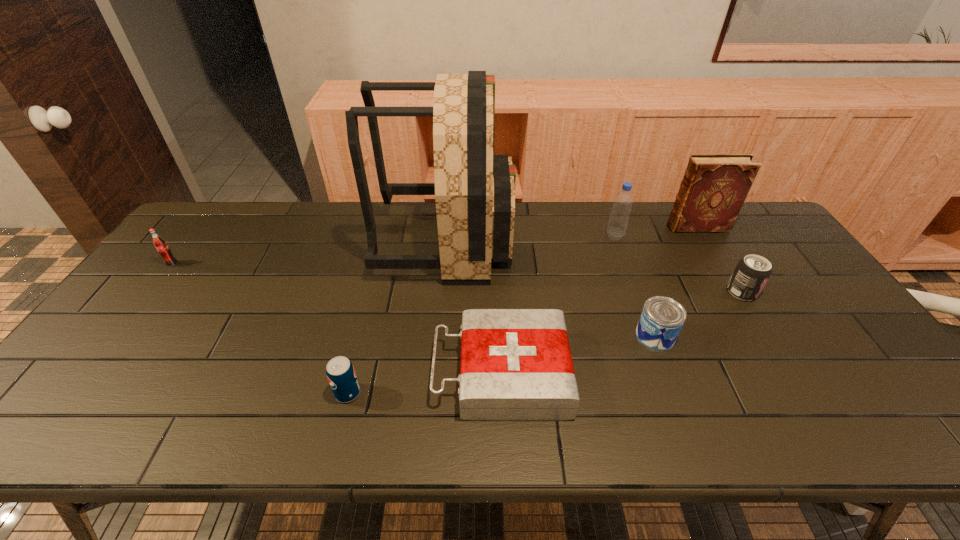
At what (x,y) coordinates should I click in order to perform the action: click on free space located on the spine side of the seventh shortest object. Please return your answer as a coordinate pair (x, y). This screenshot has height=540, width=960. Looking at the image, I should click on pyautogui.click(x=643, y=227).

This screenshot has width=960, height=540. Identify the location of free space located on the spine side of the seventh shortest object. (592, 227).

At what (x,y) coordinates should I click in order to perform the action: click on vacant space located on the spine side of the seventh shortest object. Please return your answer as a coordinate pair (x, y). The height and width of the screenshot is (540, 960). Looking at the image, I should click on (616, 227).

I want to click on vacant space situated 0.370m on the front of the bottle, so click(649, 330).

Where is `vacant space situated on the label of the leftmost pop`? This screenshot has height=540, width=960. vacant space situated on the label of the leftmost pop is located at coordinates (133, 314).

Identify the location of blank area located 0.250m on the front of the rightmost pop. This screenshot has height=540, width=960. (795, 379).

The height and width of the screenshot is (540, 960). I want to click on vacant point located on the back of the nearest pop, so click(x=374, y=287).

Where is `vacant space located on the front label of the can`? This screenshot has height=540, width=960. vacant space located on the front label of the can is located at coordinates (558, 336).

Where is `free location located 0.130m on the front label of the can`? free location located 0.130m on the front label of the can is located at coordinates (586, 336).

Identify the location of free space located on the front label of the can. The image size is (960, 540). (492, 336).